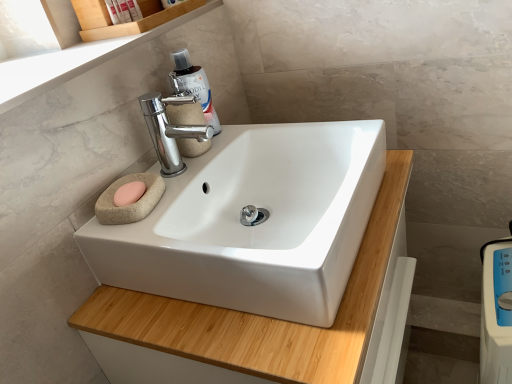
You are a GUI agent. You are given a task and a screenshot of the screen. Output one action in this format:
    pyautogui.click(x=<x>, y=<y>)
    Task: Click on the free space in front of white plastic bottle at upper left, acting as the 2th toiletry starting from the left
    
    Given the screenshot: What is the action you would take?
    click(x=126, y=35)